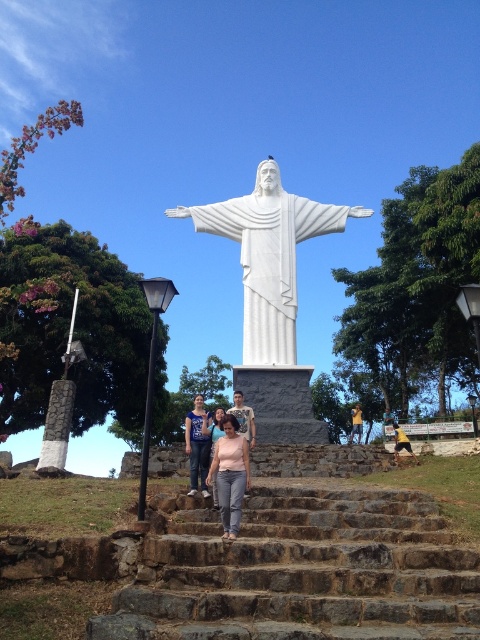
Question: Is brown stone stairs at center positioned behind pink matte shirt at center?

Choices:
 (A) no
 (B) yes

Answer: (A)

Question: Observing the image, what is the correct spatial positioning of pink matte shirt at center in reference to blue denim shirt at center?

Choices:
 (A) left
 (B) right

Answer: (B)

Question: Estimate the real-world distances between objects in this image. Which object is closer to the white marble statue at center?

Choices:
 (A) matte pink shirt at center
 (B) pink matte shirt at center

Answer: (A)

Question: Which point is closer to the camera?

Choices:
 (A) blue denim shirt at center
 (B) matte pink shirt at center
 (C) pink matte shirt at center
 (D) brown stone stairs at center

Answer: (D)

Question: Is white marble statue at center wider than matte pink shirt at center?

Choices:
 (A) yes
 (B) no

Answer: (A)

Question: Estimate the real-world distances between objects in this image. Which object is farther from the matte pink shirt at center?

Choices:
 (A) white marble statue at center
 (B) pink matte shirt at center

Answer: (A)